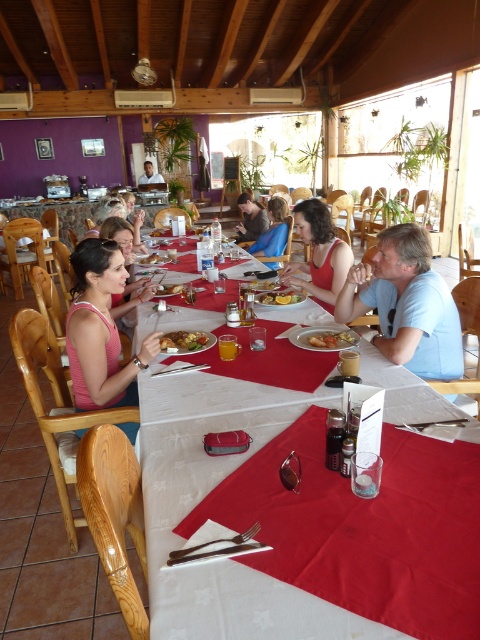
You are a server in the restaurant and need to place a new table between the two points, point (263,620) and point (264,284). Which point should the table be closer to in order to be nearer to the diners sitting at the existing tables?

The table should be placed closer to point (263,620) because it is closer to the viewer, meaning it is positioned nearer to where the diners are sitting compared to point (264,284) which is further away.